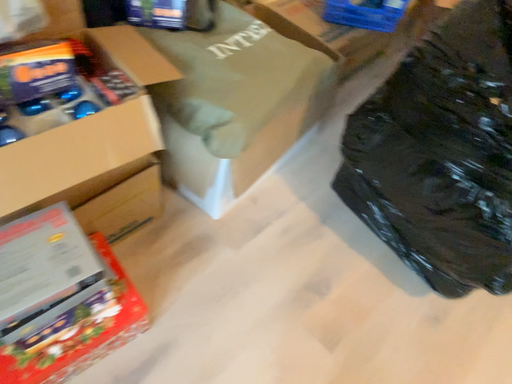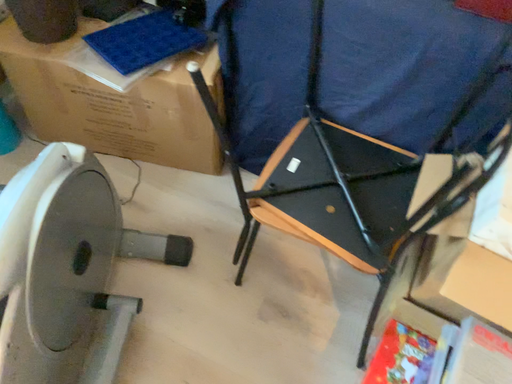
Question: How did the camera likely rotate when shooting the video?

Choices:
 (A) rotated right
 (B) rotated left

Answer: (B)